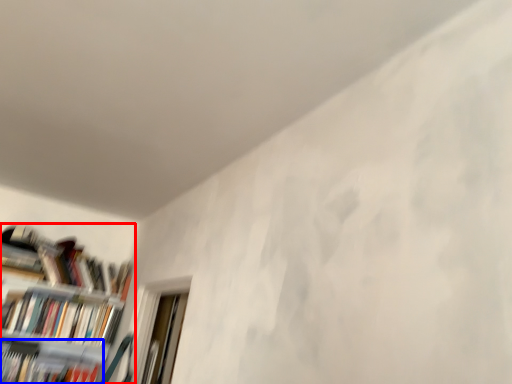
Question: Which point is further to the camera, bookcase (highlighted by a red box) or book (highlighted by a blue box)?

Choices:
 (A) bookcase
 (B) book

Answer: (B)